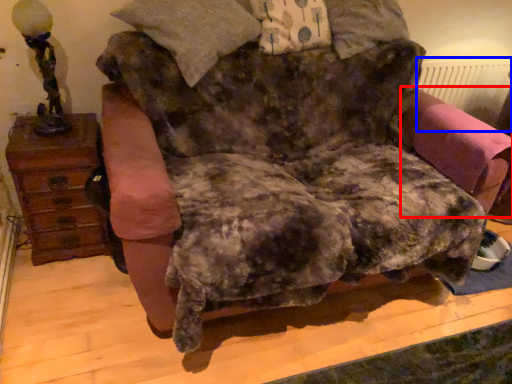
Question: Which object appears closest to the camera in this image, swivel chair (highlighted by a red box) or radiator (highlighted by a blue box)?

Choices:
 (A) swivel chair
 (B) radiator

Answer: (A)